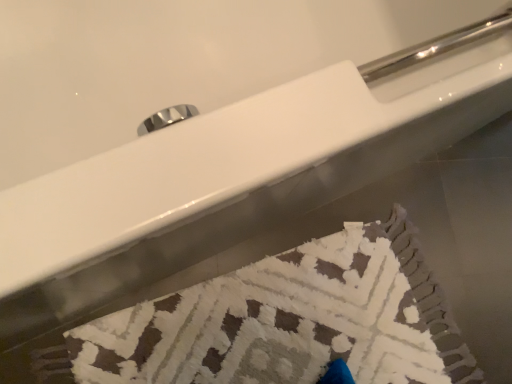
Question: Should I look upward or downward to see white textured bath towel at lower center?

Choices:
 (A) up
 (B) down

Answer: (B)